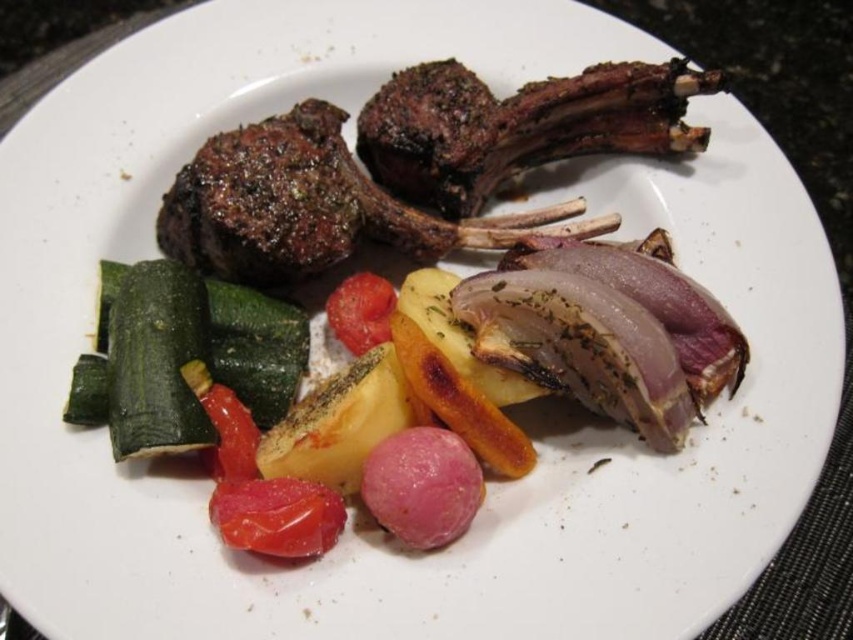
Can you confirm if grilled dark brown bone-in rib at upper right is bigger than glossy red tomato at lower center?

Yes.

Who is lower down, grilled dark brown bone-in rib at upper right or glossy red tomato at lower center?

glossy red tomato at lower center is lower down.

Is point (465, 161) closer to viewer compared to point (282, 504)?

That is False.

The image size is (853, 640). What are the coordinates of `grilled dark brown bone-in rib at upper right` in the screenshot? It's located at (518, 125).

Can you confirm if green zucchini at lower left is positioned above glossy red tomato at lower center?

Indeed, green zucchini at lower left is positioned over glossy red tomato at lower center.

Is point (291, 320) positioned behind point (280, 486)?

Yes, point (291, 320) is behind point (280, 486).

You are a GUI agent. You are given a task and a screenshot of the screen. Output one action in this format:
    pyautogui.click(x=<x>, y=<y>)
    Task: Click on the green zucchini at lower left
    The image size is (853, 640).
    Given the screenshot: What is the action you would take?
    pyautogui.click(x=183, y=356)

Does grilled dark brown bone-in rib at upper right have a lesser height compared to green zucchini at lower left?

Indeed, grilled dark brown bone-in rib at upper right has a lesser height compared to green zucchini at lower left.

Who is more distant from viewer, (519,131) or (234,344)?

The point (519,131) is more distant.

This screenshot has width=853, height=640. What are the coordinates of `grilled dark brown bone-in rib at upper right` in the screenshot? It's located at (518, 125).